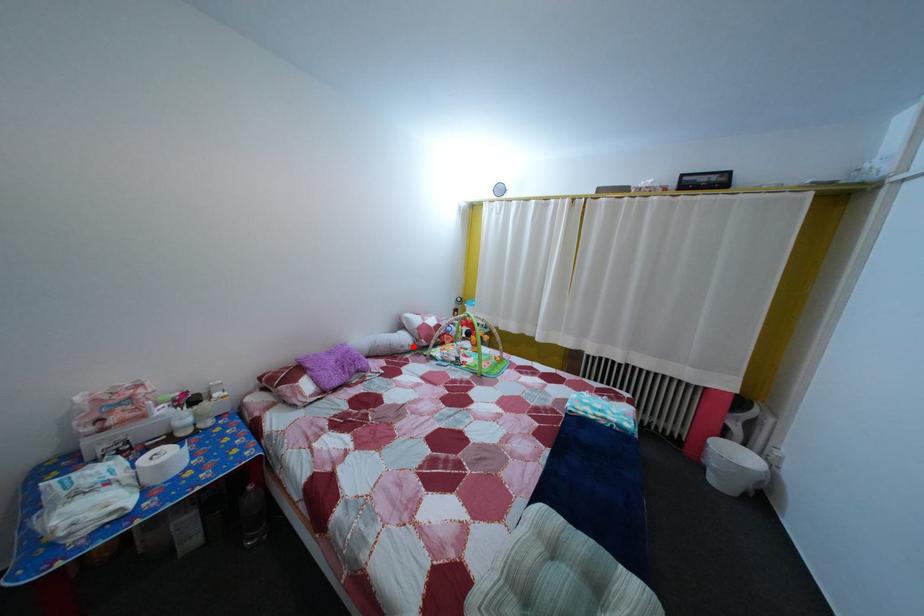
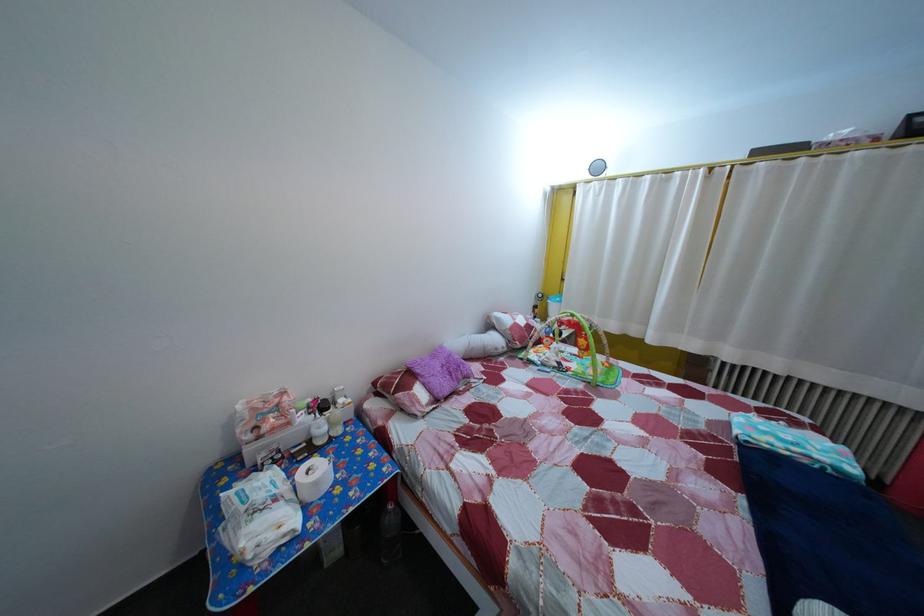
Find the pixel in the second image that matches the highlighted location in the first image.

(505, 347)